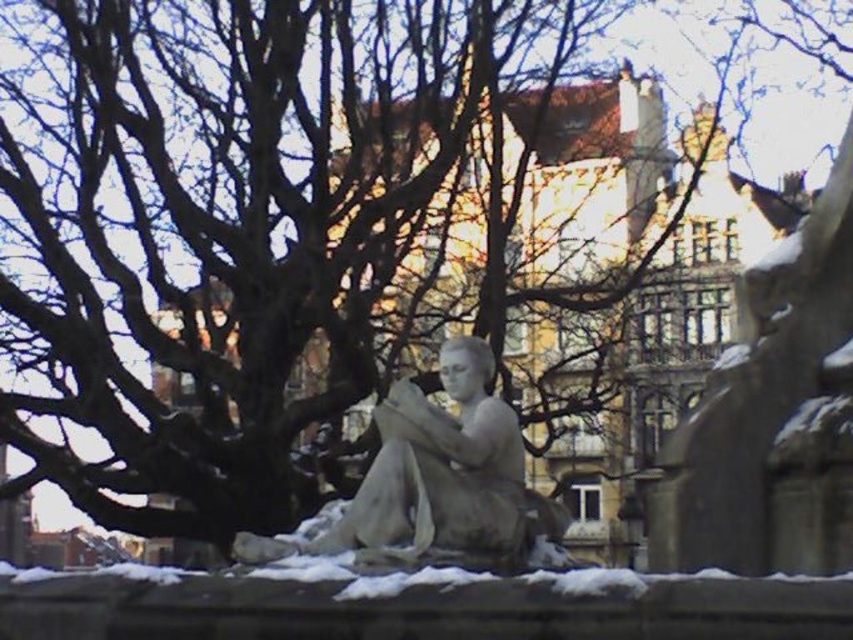
Question: Which of the following is the farthest from the observer?

Choices:
 (A) white powdery snow at lower center
 (B) white marble statue at center

Answer: (B)

Question: Can you confirm if white marble statue at center is positioned below white powdery snow at lower center?

Choices:
 (A) yes
 (B) no

Answer: (B)

Question: Does white marble statue at center appear under white powdery snow at lower center?

Choices:
 (A) no
 (B) yes

Answer: (A)

Question: Does white marble statue at center have a lesser width compared to white powdery snow at lower center?

Choices:
 (A) yes
 (B) no

Answer: (A)